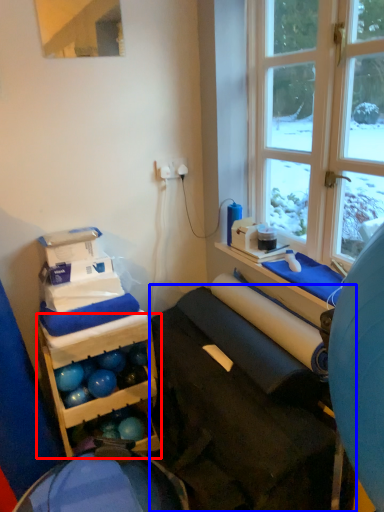
Question: Which object appears farthest to the camera in this image, shelf (highlighted by a red box) or furniture (highlighted by a blue box)?

Choices:
 (A) shelf
 (B) furniture

Answer: (A)